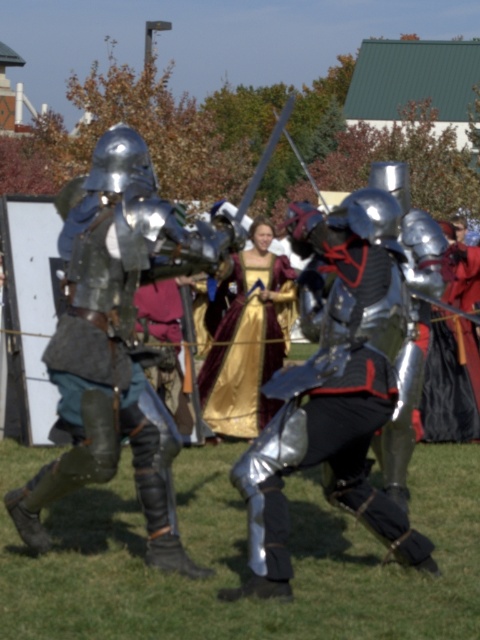
Question: Considering the real-world distances, which object is closest to the shiny silver armor at center?

Choices:
 (A) gold satin dress at center
 (B) shiny silver armor at left

Answer: (B)

Question: Among these points, which one is nearest to the camera?

Choices:
 (A) (90, 380)
 (B) (365, 324)

Answer: (A)

Question: Does shiny silver armor at left have a larger size compared to gold satin dress at center?

Choices:
 (A) no
 (B) yes

Answer: (A)

Question: Considering the relative positions of shiny silver armor at left and gold satin dress at center in the image provided, where is shiny silver armor at left located with respect to gold satin dress at center?

Choices:
 (A) right
 (B) left

Answer: (B)

Question: Is shiny silver armor at left to the left of shiny silver armor at center from the viewer's perspective?

Choices:
 (A) no
 (B) yes

Answer: (B)

Question: Which point is farther to the camera?

Choices:
 (A) gold satin dress at center
 (B) shiny silver armor at left
 (C) shiny silver armor at center

Answer: (A)